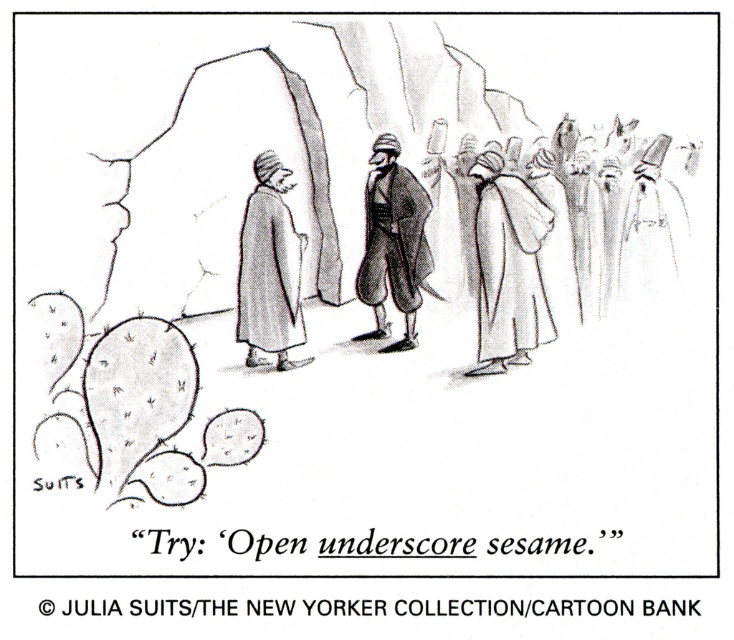
Question: Is smooth stone cave at center smaller than matte brown robe at center?

Choices:
 (A) yes
 (B) no

Answer: (A)

Question: Is white cotton robe at center positioned behind matte brown robe at center?

Choices:
 (A) no
 (B) yes

Answer: (A)

Question: Which of the following is the farthest from the observer?

Choices:
 (A) (291, 292)
 (B) (250, 109)
 (C) (672, 241)
 (D) (537, 234)

Answer: (B)

Question: Is the position of white matte robe at center less distant than that of white cotton robe at center?

Choices:
 (A) yes
 (B) no

Answer: (A)

Question: Which of these objects is positioned closest to the smooth white robe at center?

Choices:
 (A) smooth stone cave at center
 (B) white cotton robe at center
 (C) white matte robe at center
 (D) matte brown robe at center

Answer: (C)

Question: Which point is farther to the camera?

Choices:
 (A) matte brown robe at center
 (B) smooth white robe at center
 (C) white matte robe at center

Answer: (A)